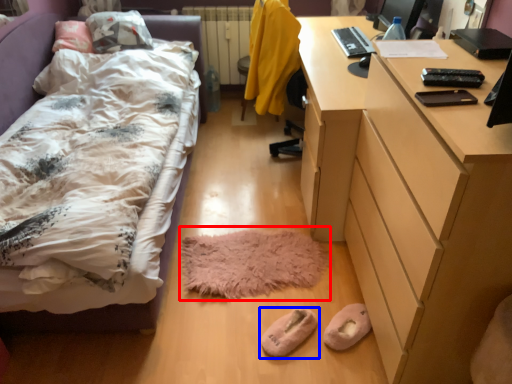
Question: Which point is closer to the camera, mat (highlighted by a red box) or footwear (highlighted by a blue box)?

Choices:
 (A) mat
 (B) footwear

Answer: (B)